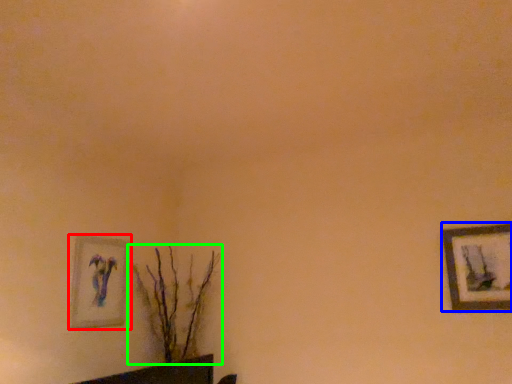
Question: Which is nearer to the picture frame (highlighted by a red box)? picture frame (highlighted by a blue box) or houseplant (highlighted by a green box).

Choices:
 (A) picture frame
 (B) houseplant

Answer: (B)